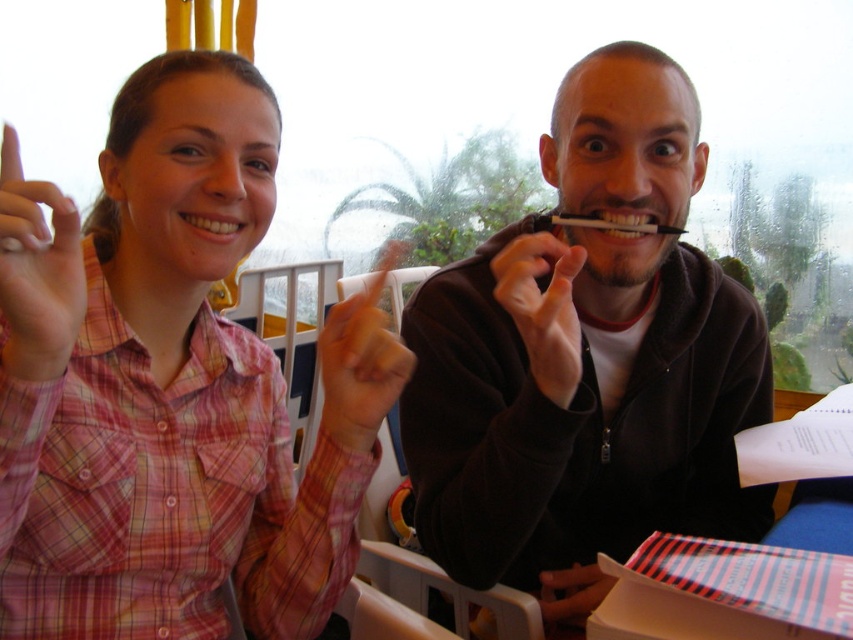
You are a photographer setting up a shot of the two people in the scene. You need to ensure that the black matte pen at center and the pink plaid shirt at upper left are both visible in the frame. Based on their positions, which object should you focus on first to capture both in the frame?

The black matte pen at center is located below the pink plaid shirt at upper left, so focusing on the pink plaid shirt at upper left first will ensure both objects are in the frame as the pen is positioned below it.

You are a robot with a 10 inch wide arm. You need to place an object between the orange matte finger at center and the white plastic toothpick at center. Can your arm fit in the space between them?

The space between the orange matte finger at center and the white plastic toothpick at center is 12.23 inches. Since your arm is 10 inches wide, it can fit in the space between them.